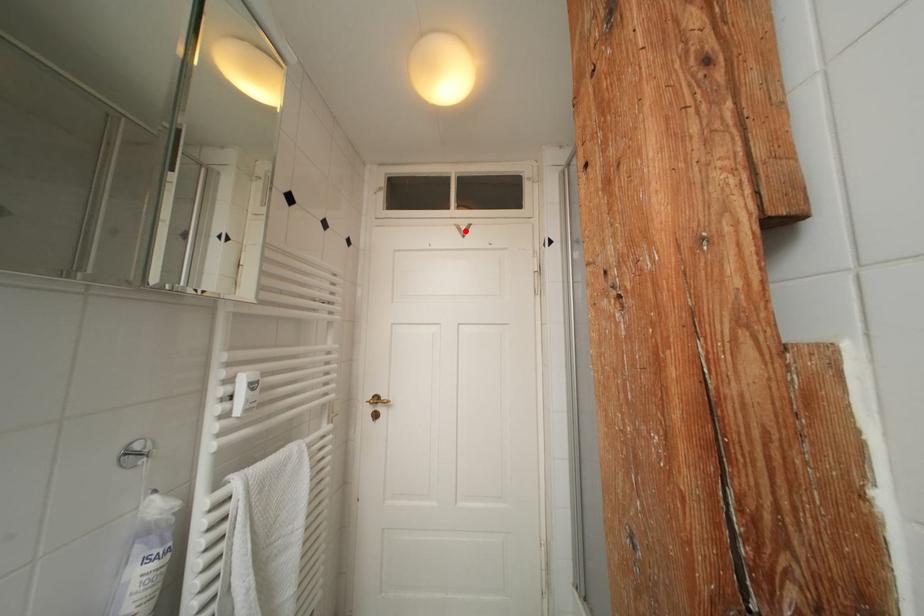
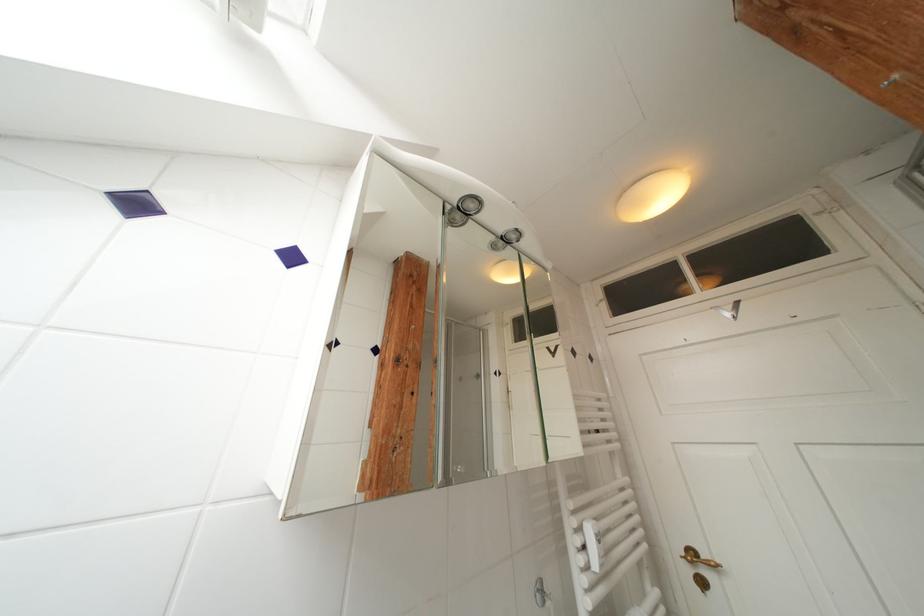
Question: I am providing you with two images of the same scene from different viewpoints. A red point is marked on the first image. Is the red point's position out of view in image 2?

Choices:
 (A) Yes
 (B) No

Answer: (B)